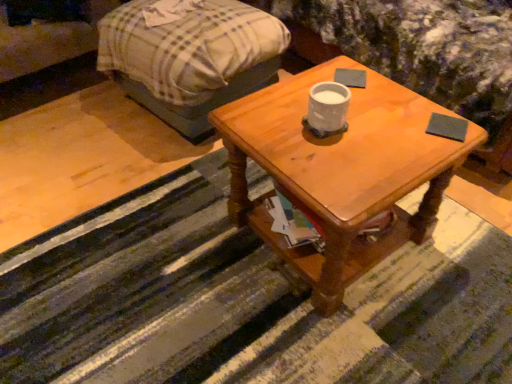
You are a GUI agent. You are given a task and a screenshot of the screen. Output one action in this format:
    pyautogui.click(x=<x>, y=<y>)
    Task: Click on the vacant space to the right of dark gray matte pad at upper center, placed as the 1th pad when sorted from back to front
    Image resolution: width=512 pixels, height=384 pixels.
    Given the screenshot: What is the action you would take?
    pyautogui.click(x=391, y=87)